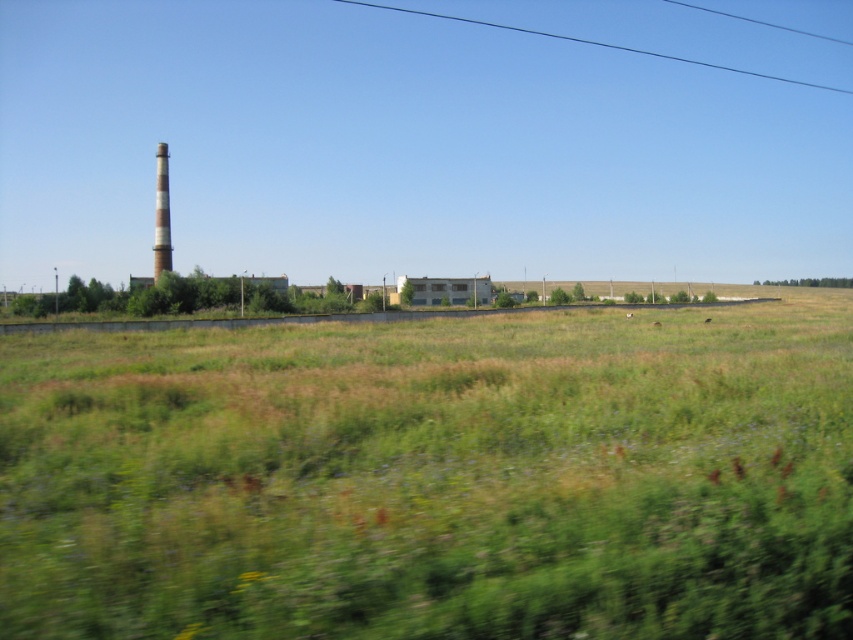
Is black wire at upper center to the right of white striped chimney at left from the viewer's perspective?

Indeed, black wire at upper center is positioned on the right side of white striped chimney at left.

Who is higher up, black wire at upper center or white striped chimney at left?

Positioned higher is black wire at upper center.

At what (x,y) coordinates should I click in order to perform the action: click on black wire at upper center. Please return your answer as a coordinate pair (x, y). This screenshot has width=853, height=640. Looking at the image, I should click on (592, 44).

Who is more distant from viewer, (378, 449) or (419, 13)?

The point (419, 13) is more distant.

Does green grassy field at center have a lesser height compared to black wire at upper center?

Yes.

The width and height of the screenshot is (853, 640). Describe the element at coordinates (434, 477) in the screenshot. I see `green grassy field at center` at that location.

Find the location of `green grassy field at center`. green grassy field at center is located at coordinates coord(434,477).

Is green grassy field at center wider than white striped chimney at left?

No, green grassy field at center is not wider than white striped chimney at left.

The height and width of the screenshot is (640, 853). What do you see at coordinates (434, 477) in the screenshot?
I see `green grassy field at center` at bounding box center [434, 477].

Find the location of a particular element. The image size is (853, 640). green grassy field at center is located at coordinates (434, 477).